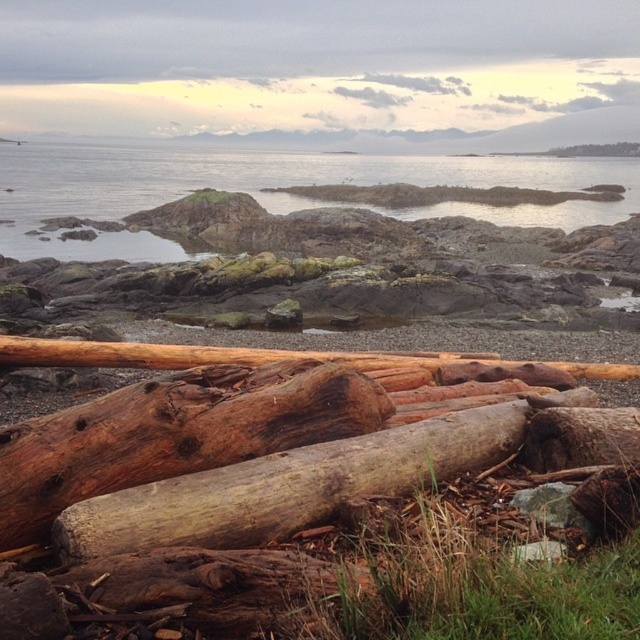
You are standing on the pebbled beach and see two pieces of brown rough wood. One is labeled as brown rough wood at center and the other as brown rough wood at upper right. Which one is positioned to the left when viewed from your perspective?

The brown rough wood at center is positioned to the left of the brown rough wood at upper right.